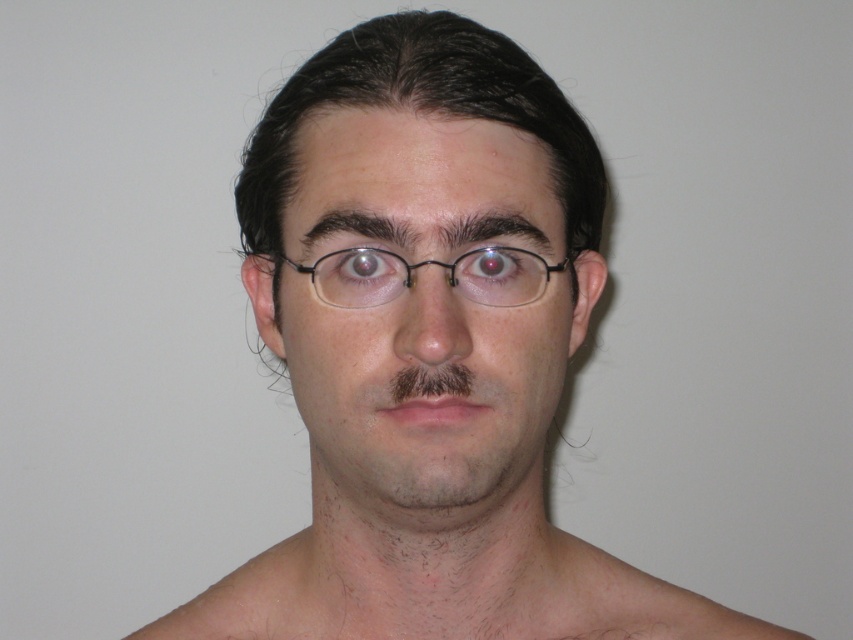
Question: Among these points, which one is nearest to the camera?

Choices:
 (A) (547, 268)
 (B) (299, 228)
 (C) (334, 273)

Answer: (C)

Question: Which point is farther from the camera taking this photo?

Choices:
 (A) (503, 257)
 (B) (349, 273)

Answer: (A)

Question: Where is glossy red eye at center located in relation to glossy white eye at upper center in the image?

Choices:
 (A) below
 (B) above

Answer: (A)

Question: Where is smooth skin face at center located in relation to glossy red eye at center in the image?

Choices:
 (A) left
 (B) right

Answer: (B)

Question: Is smooth skin face at center positioned in front of glossy white eye at upper center?

Choices:
 (A) yes
 (B) no

Answer: (A)

Question: Which of the following is the closest to the observer?

Choices:
 (A) glossy white eye at upper center
 (B) glossy red eye at center
 (C) smooth skin face at center

Answer: (C)